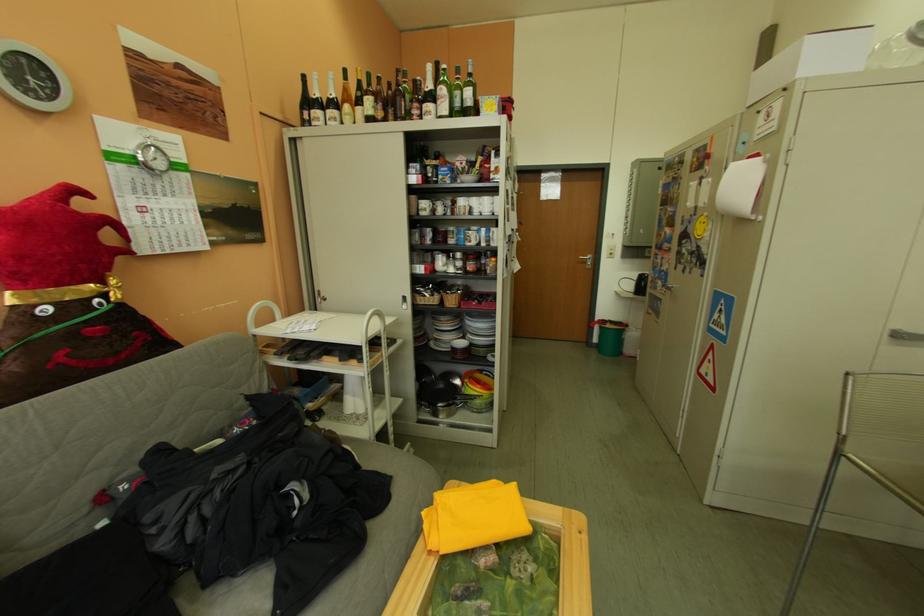
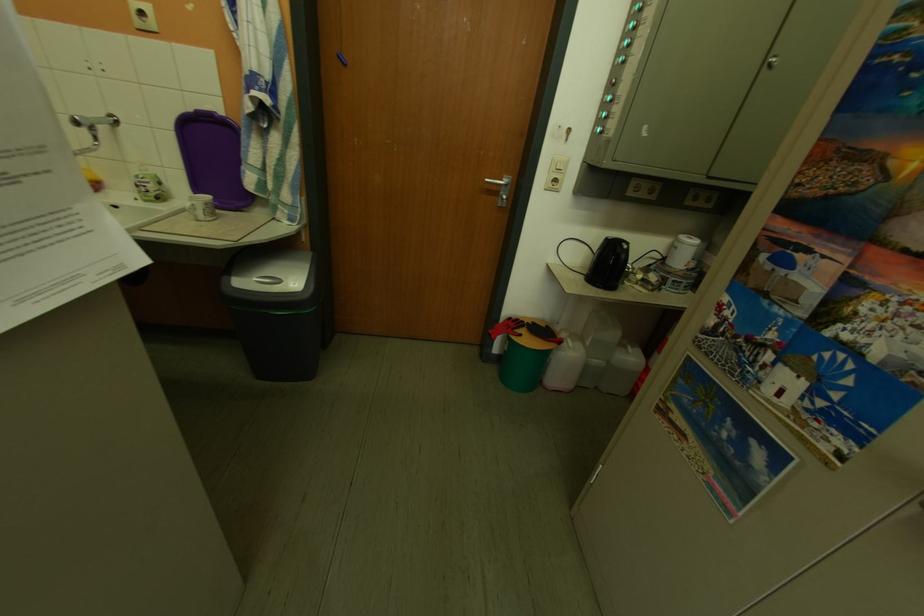
What movement of the cameraman would produce the second image?

The cameraman moved toward right, forward.